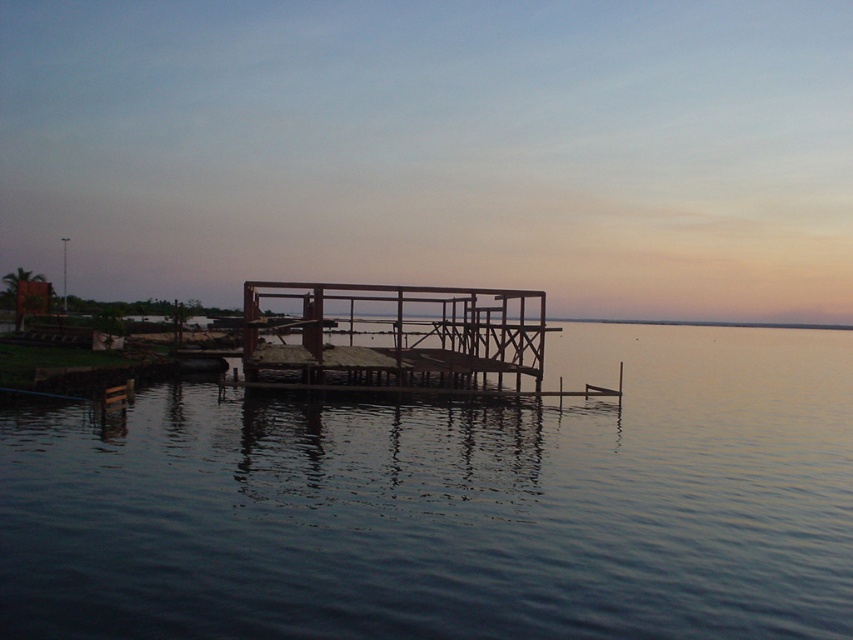
Question: Which object appears closest to the camera in this image?

Choices:
 (A) wooden dock at center
 (B) transparent water at center

Answer: (B)

Question: Can you confirm if transparent water at center is wider than wooden dock at center?

Choices:
 (A) no
 (B) yes

Answer: (B)

Question: Which point is farther from the camera taking this photo?

Choices:
 (A) (306, 579)
 (B) (314, 368)

Answer: (B)

Question: Which object appears farthest from the camera in this image?

Choices:
 (A) wooden dock at center
 (B) transparent water at center

Answer: (A)

Question: Is transparent water at center in front of wooden dock at center?

Choices:
 (A) no
 (B) yes

Answer: (B)

Question: Does transparent water at center have a greater width compared to wooden dock at center?

Choices:
 (A) yes
 (B) no

Answer: (A)